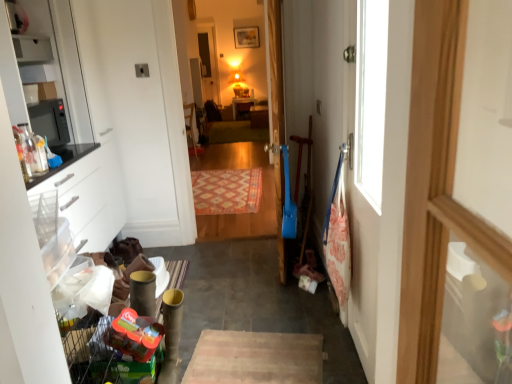
Question: Does orange woven rug at center, the 1th mat positioned from the bottom, have a lesser height compared to translucent plastic toy at lower left?

Choices:
 (A) no
 (B) yes

Answer: (B)

Question: Is orange woven rug at center, acting as the second mat starting from the back, positioned with its back to translucent plastic toy at lower left?

Choices:
 (A) no
 (B) yes

Answer: (A)

Question: Can you confirm if orange woven rug at center, the 1th mat positioned from the bottom, is wider than translucent plastic toy at lower left?

Choices:
 (A) no
 (B) yes

Answer: (B)

Question: From the image's perspective, would you say orange woven rug at center, acting as the second mat starting from the back, is positioned over translucent plastic toy at lower left?

Choices:
 (A) yes
 (B) no

Answer: (A)

Question: Is orange woven rug at center, the 1th mat positioned from the bottom, bigger than translucent plastic toy at lower left?

Choices:
 (A) yes
 (B) no

Answer: (A)

Question: In terms of size, does carpeted wooden floor at center appear bigger or smaller than matte white shelf at upper left?

Choices:
 (A) small
 (B) big

Answer: (B)

Question: From the image's perspective, is carpeted wooden floor at center above or below matte white shelf at upper left?

Choices:
 (A) below
 (B) above

Answer: (A)

Question: Is carpeted wooden floor at center to the left or to the right of matte white shelf at upper left in the image?

Choices:
 (A) left
 (B) right

Answer: (B)

Question: From a real-world perspective, is carpeted wooden floor at center positioned above or below matte white shelf at upper left?

Choices:
 (A) above
 (B) below

Answer: (B)

Question: From a real-world perspective, is wooden table at center above or below green carpet at center, which is the second mat from bottom to top?

Choices:
 (A) above
 (B) below

Answer: (A)

Question: From the image's perspective, is wooden table at center above or below green carpet at center, which is the second mat from bottom to top?

Choices:
 (A) above
 (B) below

Answer: (A)

Question: Is wooden table at center inside or outside of green carpet at center, which is counted as the second mat, starting from the front?

Choices:
 (A) inside
 (B) outside

Answer: (B)

Question: Considering the positions of point (253, 99) and point (238, 122), is point (253, 99) closer or farther from the camera than point (238, 122)?

Choices:
 (A) closer
 (B) farther

Answer: (A)

Question: In the image, is blue plastic door at center positioned in front of or behind translucent plastic toy at lower left?

Choices:
 (A) front
 (B) behind

Answer: (B)

Question: Is point (279, 233) closer or farther from the camera than point (138, 319)?

Choices:
 (A) closer
 (B) farther

Answer: (B)